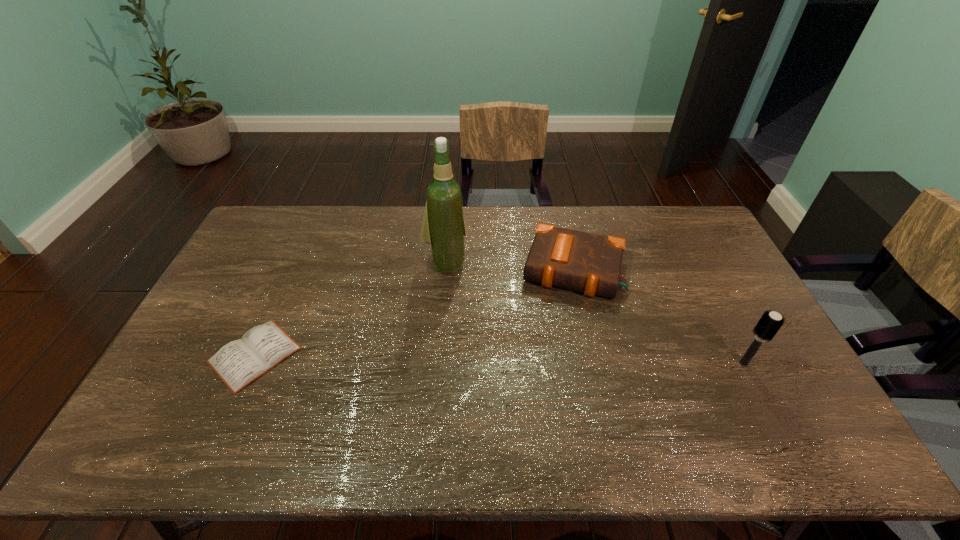
This screenshot has width=960, height=540. Find the location of `vacant spot on the desktop that is between the leftmost object and the hairbrush and is positioned on the front-facing side of the tallest object`. vacant spot on the desktop that is between the leftmost object and the hairbrush and is positioned on the front-facing side of the tallest object is located at coordinates (476, 359).

You are a GUI agent. You are given a task and a screenshot of the screen. Output one action in this format:
    pyautogui.click(x=<x>, y=<y>)
    Task: Click on the free spot on the desktop that is between the diary and the second tallest object and is positioned on the spine side of the second shortest object
    This screenshot has width=960, height=540.
    Given the screenshot: What is the action you would take?
    pyautogui.click(x=552, y=360)